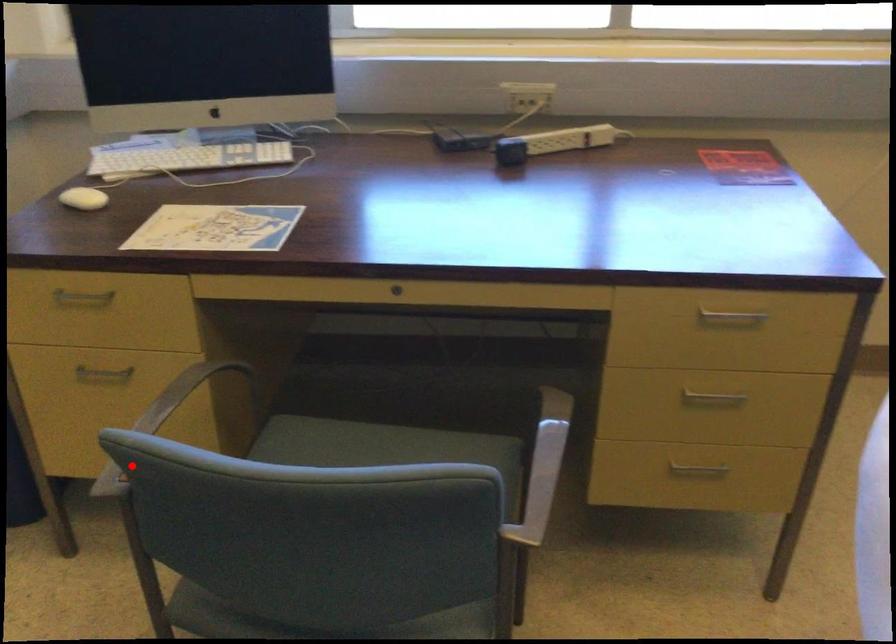
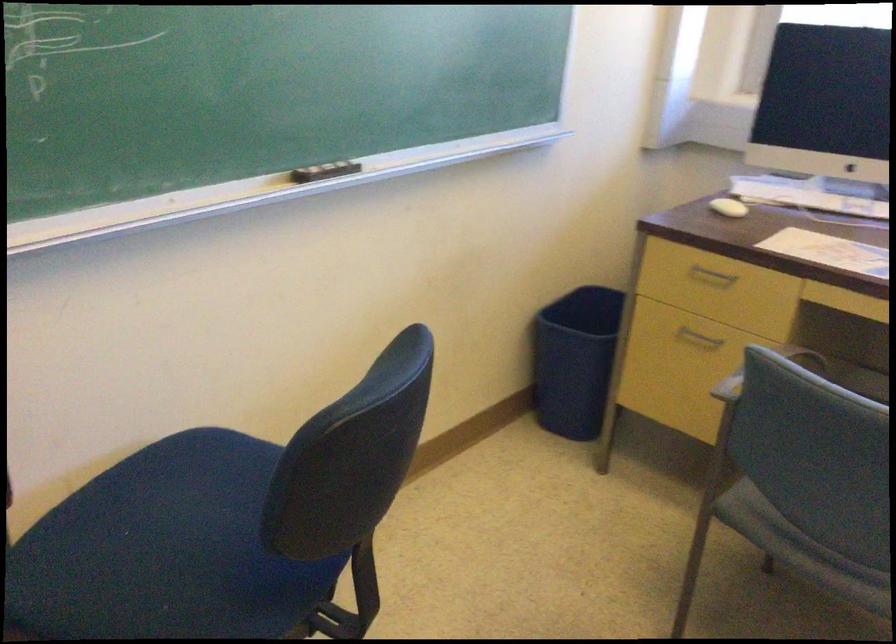
Question: A red point is marked in image1. In image2, is the corresponding 3D point closer to the camera or farther? Reply with the corresponding letter.

Choices:
 (A) The corresponding 3D point is closer.
 (B) The corresponding 3D point is farther.

Answer: (B)